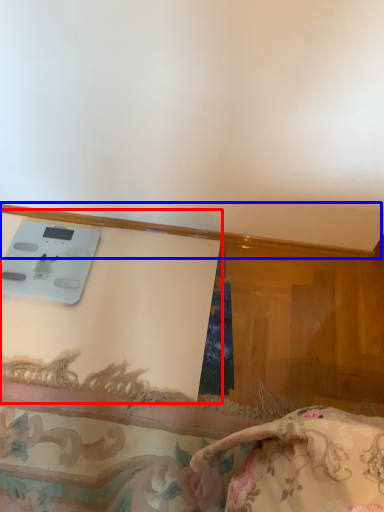
Question: Which object appears closest to the camera in this image, table (highlighted by a red box) or trim (highlighted by a blue box)?

Choices:
 (A) table
 (B) trim

Answer: (A)